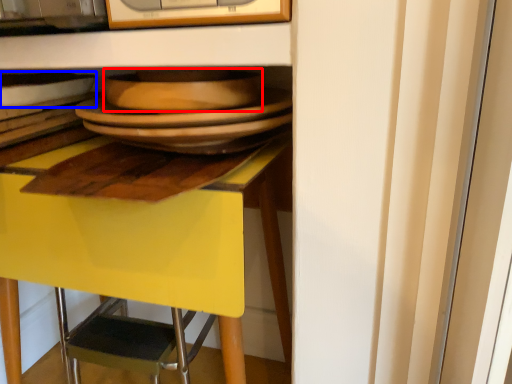
Question: Which of the following is the farthest to the observer, platter (highlighted by a red box) or tableware (highlighted by a blue box)?

Choices:
 (A) platter
 (B) tableware

Answer: (B)